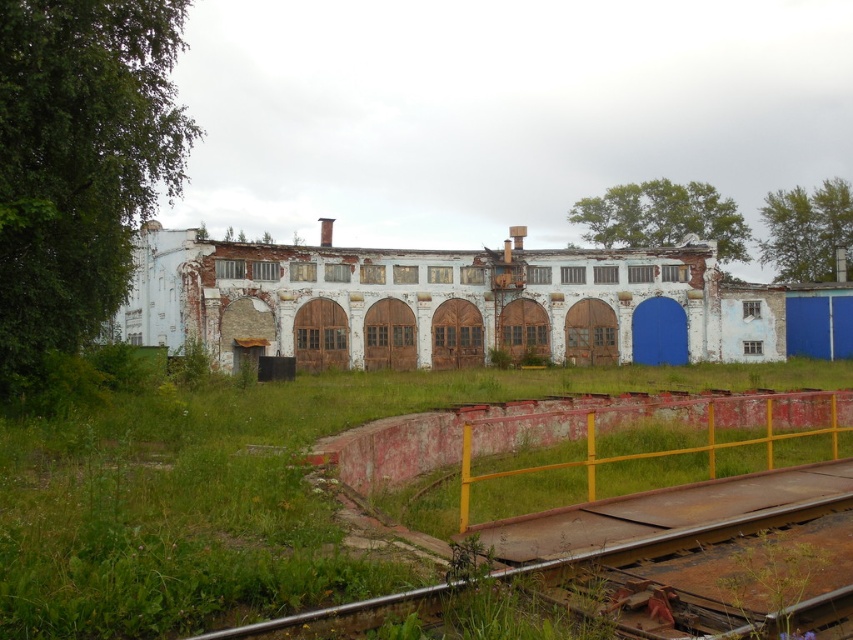
Question: Which of the following is the farthest from the observer?

Choices:
 (A) (310, 621)
 (B) (802, 593)

Answer: (B)

Question: Is the position of rusty metal rail at lower right more distant than that of green leafy weed at lower right?

Choices:
 (A) no
 (B) yes

Answer: (B)

Question: Considering the real-world distances, which object is farthest from the rusty metal train track at lower center?

Choices:
 (A) rusty metal rail at lower right
 (B) green leafy weed at lower right

Answer: (A)

Question: Can you confirm if rusty metal rail at lower right is positioned to the left of green leafy weed at lower right?

Choices:
 (A) yes
 (B) no

Answer: (B)

Question: Does rusty metal rail at lower right lie behind rusty metal train track at lower center?

Choices:
 (A) no
 (B) yes

Answer: (B)

Question: Among these objects, which one is farthest from the camera?

Choices:
 (A) rusty metal rail at lower right
 (B) green leafy weed at lower right

Answer: (A)